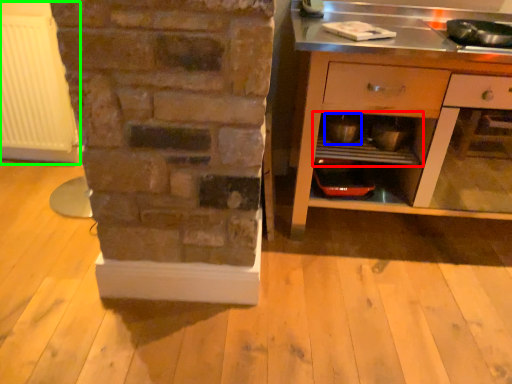
Question: Estimate the real-world distances between objects in this image. Which object is closer to shelf (highlighted by a red box), appliance (highlighted by a blue box) or radiator (highlighted by a green box)?

Choices:
 (A) appliance
 (B) radiator

Answer: (A)